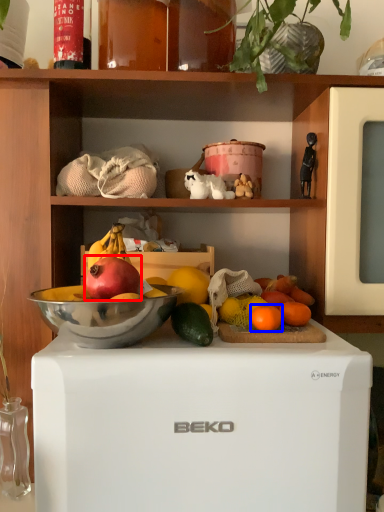
Question: Which object is closer to the camera taking this photo, grapefruit (highlighted by a red box) or grapefruit (highlighted by a blue box)?

Choices:
 (A) grapefruit
 (B) grapefruit

Answer: (A)